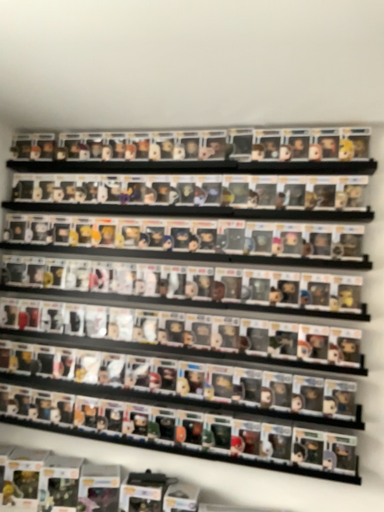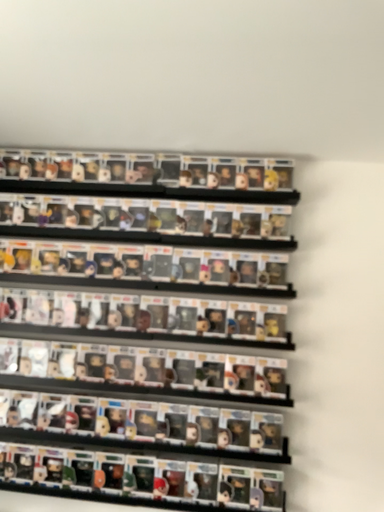
Question: How did the camera likely rotate when shooting the video?

Choices:
 (A) rotated left
 (B) rotated right

Answer: (B)